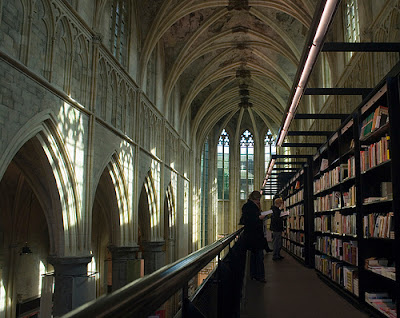
At what (x,y) coordinates should I click in order to perform the action: click on left wall. Please return your answer as a coordinate pair (x, y). The width and height of the screenshot is (400, 318). Looking at the image, I should click on (121, 128).